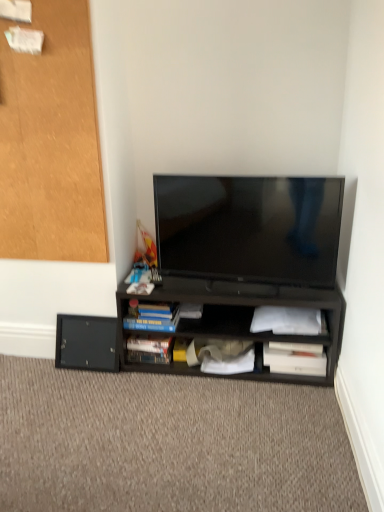
Identify the location of white paper at lower right, which is the first paperback book in right-to-left order. (294, 362).

Identify the location of blue matte paperback book at center, the second paperback book in the left-to-right sequence. The image size is (384, 512). (152, 317).

This screenshot has height=512, width=384. What do you see at coordinates (149, 350) in the screenshot? I see `hardcover book at lower center, which is counted as the first paperback book, starting from the left` at bounding box center [149, 350].

The width and height of the screenshot is (384, 512). Find the location of `black matte cabinet at upper left`. black matte cabinet at upper left is located at coordinates (51, 142).

Measure the distance between point (190,310) and camera.

Point (190,310) and camera are 5.76 feet apart from each other.

Describe the element at coordinates (169, 443) in the screenshot. The height and width of the screenshot is (512, 384). I see `carpet at lower center` at that location.

The height and width of the screenshot is (512, 384). Identify the location of white paper at lower right, acting as the 4th paperback book starting from the left. (294, 362).

How distant is white paper at lower center from black matte drawer at lower left?

white paper at lower center is 17.28 inches away from black matte drawer at lower left.

Considering the relative positions of white paper at lower center and black matte drawer at lower left in the image provided, is white paper at lower center to the left of black matte drawer at lower left from the viewer's perspective?

In fact, white paper at lower center is to the right of black matte drawer at lower left.

From the image's perspective, is white paper at lower center located above black matte drawer at lower left?

Yes, from the image's perspective, white paper at lower center is above black matte drawer at lower left.

From the picture: From a real-world perspective, is white paper at lower center located beneath black matte drawer at lower left?

Actually, white paper at lower center is physically above black matte drawer at lower left in the real world.

Considering the relative positions of white paper at lower center and hardcover book at lower center, which ranks as the 4th paperback book in right-to-left order, in the image provided, is white paper at lower center to the left of hardcover book at lower center, which ranks as the 4th paperback book in right-to-left order, from the viewer's perspective?

No.

Is white paper at lower center looking in the opposite direction of hardcover book at lower center, which is counted as the first paperback book, starting from the left?

That's not correct — white paper at lower center is not looking away from hardcover book at lower center, which is counted as the first paperback book, starting from the left.

Can you confirm if white paper at lower center is thinner than hardcover book at lower center, which ranks as the 4th paperback book in right-to-left order?

Indeed, white paper at lower center has a lesser width compared to hardcover book at lower center, which ranks as the 4th paperback book in right-to-left order.

Considering the positions of point (184, 312) and point (168, 341), is point (184, 312) closer or farther from the camera than point (168, 341)?

Point (184, 312) is closer to the camera than point (168, 341).

How different are the orientations of blue matte paperback book at center, which ranks as the 3th paperback book in right-to-left order, and white paper at lower right, acting as the 4th paperback book starting from the left, in degrees?

blue matte paperback book at center, which ranks as the 3th paperback book in right-to-left order, and white paper at lower right, acting as the 4th paperback book starting from the left, are facing 0.141 degrees away from each other.

Which is closer, (129, 326) or (274, 362)?

Clearly, point (129, 326) is more distant from the camera than point (274, 362).

Is blue matte paperback book at center, which ranks as the 3th paperback book in right-to-left order, facing towards white paper at lower right, acting as the 4th paperback book starting from the left?

No, blue matte paperback book at center, which ranks as the 3th paperback book in right-to-left order, is not aimed at white paper at lower right, acting as the 4th paperback book starting from the left.

Is blue matte paperback book at center, which ranks as the 3th paperback book in right-to-left order, placed right next to white paper at lower right, acting as the 4th paperback book starting from the left?

No, blue matte paperback book at center, which ranks as the 3th paperback book in right-to-left order, is not touching white paper at lower right, acting as the 4th paperback book starting from the left.

Consider the image. Is matte black tv at center far from black matte cabinet at upper left?

No, matte black tv at center is not far away from black matte cabinet at upper left.

Can you confirm if matte black tv at center is taller than black matte cabinet at upper left?

In fact, matte black tv at center may be shorter than black matte cabinet at upper left.

Does point (330, 223) appear closer or farther from the camera than point (62, 105)?

Clearly, point (330, 223) is more distant from the camera than point (62, 105).

From the picture: Measure the distance between black matte drawer at lower left and blue matte paperback book at center, the second paperback book in the left-to-right sequence.

7.50 inches.

From the picture: Considering the sizes of black matte drawer at lower left and blue matte paperback book at center, the second paperback book in the left-to-right sequence, in the image, is black matte drawer at lower left taller or shorter than blue matte paperback book at center, the second paperback book in the left-to-right sequence,?

Considering their sizes, black matte drawer at lower left has more height than blue matte paperback book at center, the second paperback book in the left-to-right sequence.

In terms of width, does black matte drawer at lower left look wider or thinner when compared to blue matte paperback book at center, the second paperback book in the left-to-right sequence?

Clearly, black matte drawer at lower left has less width compared to blue matte paperback book at center, the second paperback book in the left-to-right sequence.

Is black matte drawer at lower left next to blue matte paperback book at center, which ranks as the 3th paperback book in right-to-left order, and touching it?

There is a gap between black matte drawer at lower left and blue matte paperback book at center, which ranks as the 3th paperback book in right-to-left order.

In terms of width, does carpet at lower center look wider or thinner when compared to white matte paper at lower right, the 2th paperback book positioned from the right?

carpet at lower center is wider than white matte paper at lower right, the 2th paperback book positioned from the right.

Does carpet at lower center turn towards white matte paper at lower right, which is counted as the third paperback book, starting from the left?

No, carpet at lower center is not oriented towards white matte paper at lower right, which is counted as the third paperback book, starting from the left.

Looking at this image, is there a large distance between carpet at lower center and white matte paper at lower right, which is counted as the third paperback book, starting from the left?

carpet at lower center is actually quite close to white matte paper at lower right, which is counted as the third paperback book, starting from the left.

This screenshot has height=512, width=384. I want to click on cabinetry above the hardcover book at lower center, which ranks as the 4th paperback book in right-to-left order (from a real-world perspective), so 51,142.

Is hardcover book at lower center, which ranks as the 4th paperback book in right-to-left order, beside black matte cabinet at upper left?

No.

Is hardcover book at lower center, which ranks as the 4th paperback book in right-to-left order, smaller than black matte cabinet at upper left?

Yes.

Considering the relative positions of hardcover book at lower center, which ranks as the 4th paperback book in right-to-left order, and black matte cabinet at upper left in the image provided, is hardcover book at lower center, which ranks as the 4th paperback book in right-to-left order, to the left or to the right of black matte cabinet at upper left?

Clearly, hardcover book at lower center, which ranks as the 4th paperback book in right-to-left order, is on the right of black matte cabinet at upper left in the image.

Locate an element on the screen. This screenshot has width=384, height=512. drawer below the white paper at lower center (from the image's perspective) is located at coordinates (86, 343).

The image size is (384, 512). I want to click on the 1st paperback book in front of the white paper at lower center, starting your count from the anchor, so click(149, 350).

Estimate the real-world distances between objects in this image. Which object is closer to black matte shelf at center, hardcover book at lower center, which is counted as the first paperback book, starting from the left, or matte black tv at center?

Among the two, matte black tv at center is located nearer to black matte shelf at center.

Based on their spatial positions, is black matte shelf at center or white paper at lower center closer to black matte cabinet at upper left?

black matte shelf at center is positioned closer to the anchor black matte cabinet at upper left.

When comparing their distances from black matte drawer at lower left, does hardcover book at lower center, which ranks as the 4th paperback book in right-to-left order, or white matte paper at lower right, the 2th paperback book positioned from the right, seem closer?

Based on the image, hardcover book at lower center, which ranks as the 4th paperback book in right-to-left order, appears to be nearer to black matte drawer at lower left.

From the image, which object appears to be farther from carpet at lower center, white matte paper at lower right, the 2th paperback book positioned from the right, or white paper at lower center?

white paper at lower center is positioned further to the anchor carpet at lower center.

Based on their spatial positions, is hardcover book at lower center, which is counted as the first paperback book, starting from the left, or black matte cabinet at upper left further from matte black tv at center?

Among the two, hardcover book at lower center, which is counted as the first paperback book, starting from the left, is located further to matte black tv at center.

Consider the image. Based on their spatial positions, is white paper at lower center or black matte cabinet at upper left further from white paper at lower right, which is the first paperback book in right-to-left order?

Based on the image, black matte cabinet at upper left appears to be further to white paper at lower right, which is the first paperback book in right-to-left order.

Based on their spatial positions, is black matte shelf at center or black matte drawer at lower left further from matte black tv at center?

black matte drawer at lower left is further to matte black tv at center.

Which object lies further to the anchor point blue matte paperback book at center, the second paperback book in the left-to-right sequence, black matte shelf at center or white paper at lower center?

black matte shelf at center is further to blue matte paperback book at center, the second paperback book in the left-to-right sequence.

Identify the location of book between blue matte paperback book at center, the second paperback book in the left-to-right sequence, and black matte shelf at center from left to right. The width and height of the screenshot is (384, 512). (190, 311).

Where is `television between blue matte paperback book at center, which ranks as the 3th paperback book in right-to-left order, and white matte paper at lower right, which is counted as the third paperback book, starting from the left, from left to right`? This screenshot has width=384, height=512. television between blue matte paperback book at center, which ranks as the 3th paperback book in right-to-left order, and white matte paper at lower right, which is counted as the third paperback book, starting from the left, from left to right is located at coordinates (249, 228).

Image resolution: width=384 pixels, height=512 pixels. Find the location of `television between hardcover book at lower center, which is counted as the first paperback book, starting from the left, and white matte paper at lower right, the 2th paperback book positioned from the right, from left to right`. television between hardcover book at lower center, which is counted as the first paperback book, starting from the left, and white matte paper at lower right, the 2th paperback book positioned from the right, from left to right is located at coordinates (249, 228).

You are a GUI agent. You are given a task and a screenshot of the screen. Output one action in this format:
    pyautogui.click(x=<x>, y=<y>)
    Task: Click on the desk between matte black tv at center and white paper at lower center from front to back
    The width and height of the screenshot is (384, 512).
    Given the screenshot: What is the action you would take?
    pyautogui.click(x=236, y=320)